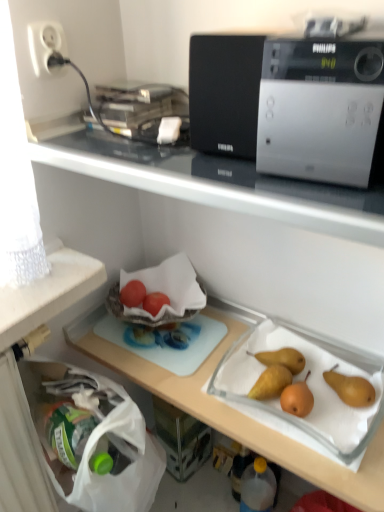
What are the coordinates of `free space above silver metallic microwave at upper center (from a real-world perspective)` in the screenshot? It's located at (344, 28).